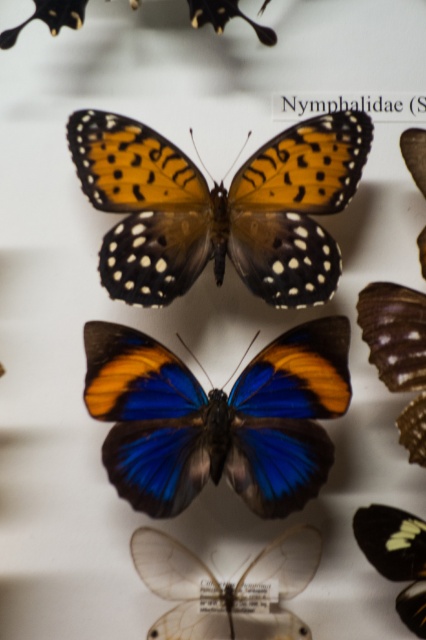
You are standing in front of the butterfly exhibit and notice two points marked on the display. Which point, point (287, 282) or point (271, 390), is closer to you?

Point (287, 282) is closer to you because it is further to the viewer than point (271, 390).